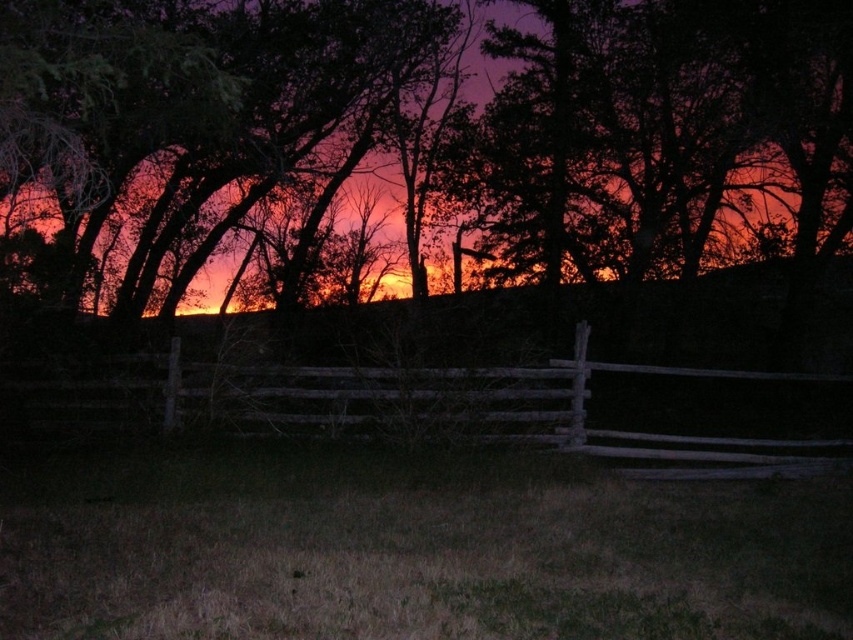
Question: Among these objects, which one is nearest to the camera?

Choices:
 (A) weathered wood fence at center
 (B) dark brown wood fence at center

Answer: (B)

Question: Can you confirm if dark brown wood fence at center is thinner than weathered wood fence at center?

Choices:
 (A) yes
 (B) no

Answer: (B)

Question: Which of the following is the closest to the observer?

Choices:
 (A) (62, 424)
 (B) (730, 156)

Answer: (A)

Question: Where is dark brown wood fence at center located in relation to weathered wood fence at center in the image?

Choices:
 (A) left
 (B) right

Answer: (A)

Question: Where is dark brown wood fence at center located in relation to weathered wood fence at center in the image?

Choices:
 (A) right
 (B) left

Answer: (B)